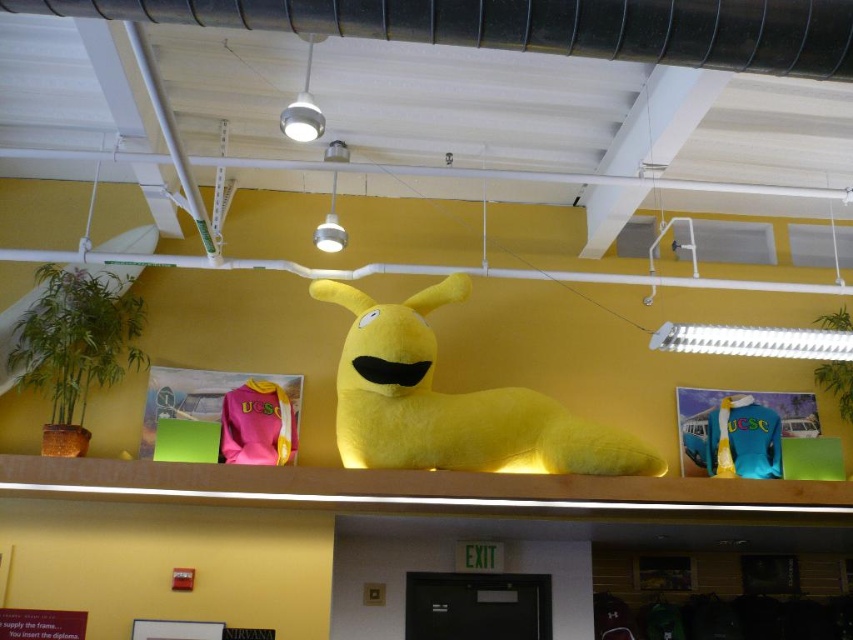
You are trying to hang a new picture between the matte yellow plush at center and the pink fleece sweatshirt at center. Given their heights, which one should you place the new picture above to ensure it doesn

The matte yellow plush at center is much taller than the pink fleece sweatshirt at center, so placing the new picture above the pink fleece sweatshirt at center would ensure it is higher up.

You are standing in the room and see two points marked in the scene. Which point is closer to you, point (544, 458) or point (747, 400)?

Point (544, 458) is in front of point (747, 400), so it is closer to you.